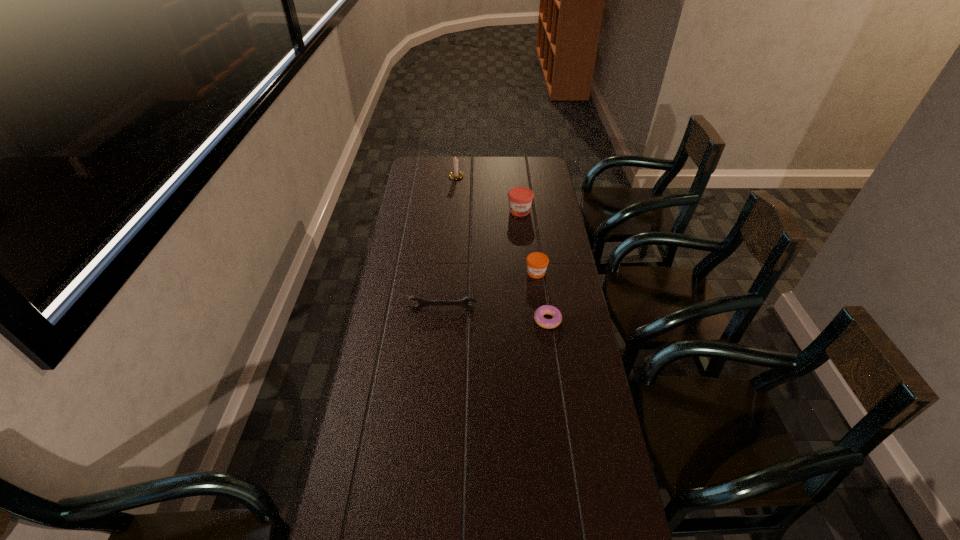
The height and width of the screenshot is (540, 960). In order to click on vacant space at the far left corner in this screenshot , I will do `click(425, 168)`.

In the image, there is a desktop. Identify the location of vacant space at the far right corner. This screenshot has width=960, height=540. (548, 158).

Where is `empty space that is in between the fourth nearest object and the farthest object`? empty space that is in between the fourth nearest object and the farthest object is located at coordinates (488, 193).

Where is `free space between the farther jam and the farthest object`? The image size is (960, 540). free space between the farther jam and the farthest object is located at coordinates (488, 193).

Find the location of a particular element. The width and height of the screenshot is (960, 540). unoccupied area between the third nearest object and the fourth tallest object is located at coordinates click(x=490, y=291).

Locate an element on the screen. This screenshot has width=960, height=540. free point between the candle holder and the farther jam is located at coordinates (488, 193).

The width and height of the screenshot is (960, 540). I want to click on vacant area that lies between the third farthest object and the wrench, so click(x=490, y=291).

Identify the location of free space that is in between the candle holder and the shortest object. (502, 248).

At what (x,y) coordinates should I click in order to perform the action: click on blank region between the doughnut and the third nearest object. Please return your answer as a coordinate pair (x, y). Looking at the image, I should click on (541, 296).

This screenshot has height=540, width=960. I want to click on object that is the second closest to the nearer jam, so click(x=463, y=302).